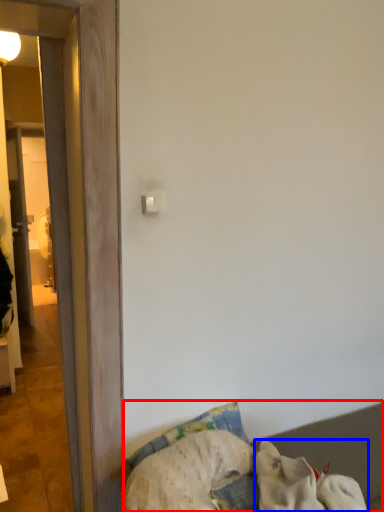
Question: Which object appears closest to the camera in this image, furniture (highlighted by a red box) or dog (highlighted by a blue box)?

Choices:
 (A) furniture
 (B) dog

Answer: (B)